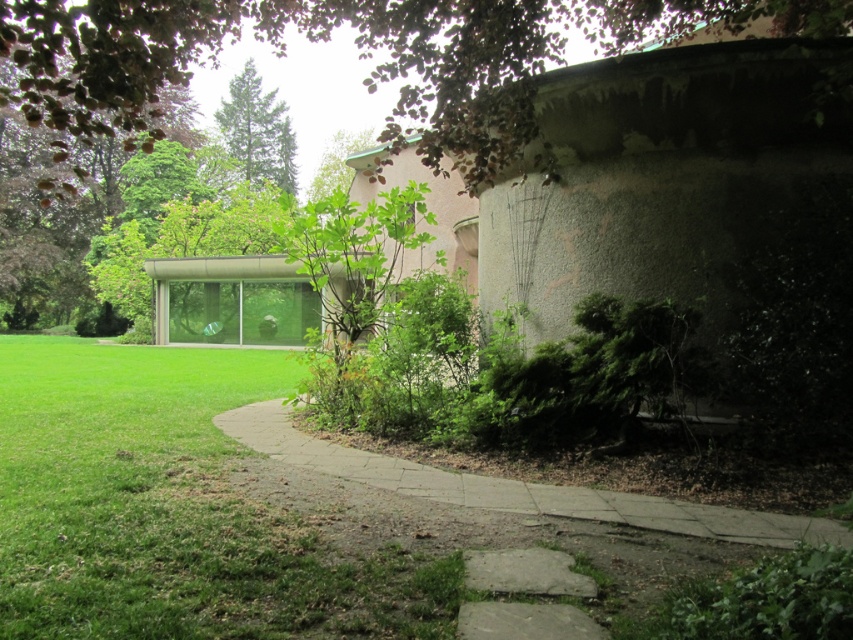
Question: Does purple-leaved tree at upper left lie in front of smooth concrete path at center?

Choices:
 (A) no
 (B) yes

Answer: (B)

Question: Which point is closer to the camera?

Choices:
 (A) smooth concrete path at center
 (B) green textured tree at upper center
 (C) purple-leaved tree at upper left

Answer: (C)

Question: Can you confirm if smooth concrete path at center is smaller than green textured tree at upper center?

Choices:
 (A) no
 (B) yes

Answer: (B)

Question: Considering the real-world distances, which object is closest to the smooth concrete path at center?

Choices:
 (A) green textured tree at upper center
 (B) purple-leaved tree at upper left

Answer: (B)

Question: Is smooth concrete path at center smaller than green textured tree at upper center?

Choices:
 (A) no
 (B) yes

Answer: (B)

Question: Estimate the real-world distances between objects in this image. Which object is farther from the purple-leaved tree at upper left?

Choices:
 (A) smooth concrete path at center
 (B) green textured tree at upper center

Answer: (A)